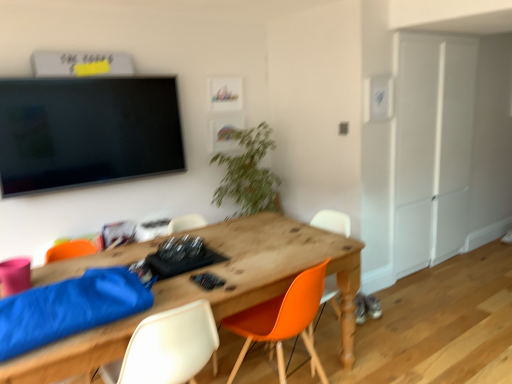
Question: Should I look upward or downward to see orange plastic chair at center, which is the second chair in right-to-left order?

Choices:
 (A) down
 (B) up

Answer: (A)

Question: From the image's perspective, does orange plastic chair at center, which is the second chair in right-to-left order, appear higher than wooden desk at center?

Choices:
 (A) no
 (B) yes

Answer: (B)

Question: Is orange plastic chair at center, which is the second chair in right-to-left order, further to camera compared to wooden desk at center?

Choices:
 (A) no
 (B) yes

Answer: (B)

Question: Is orange plastic chair at center, which is the second chair in right-to-left order, to the right of wooden desk at center from the viewer's perspective?

Choices:
 (A) no
 (B) yes

Answer: (B)

Question: Is orange plastic chair at center, which is the second chair from left to right, not within wooden desk at center?

Choices:
 (A) no
 (B) yes

Answer: (A)

Question: From the image's perspective, is orange plastic chair at center, which is the second chair from left to right, under wooden desk at center?

Choices:
 (A) no
 (B) yes

Answer: (A)

Question: Is orange plastic chair at center, which is the second chair in right-to-left order, bigger than wooden desk at center?

Choices:
 (A) no
 (B) yes

Answer: (A)

Question: Considering the relative sizes of orange plastic chair at center, which is the second chair in right-to-left order, and orange matte chair at center, the third chair from the left, in the image provided, is orange plastic chair at center, which is the second chair in right-to-left order, bigger than orange matte chair at center, the third chair from the left,?

Choices:
 (A) yes
 (B) no

Answer: (A)

Question: From the image's perspective, does orange plastic chair at center, which is the second chair from left to right, appear higher than orange matte chair at center, the third chair from the left?

Choices:
 (A) no
 (B) yes

Answer: (A)

Question: Considering the relative sizes of orange plastic chair at center, which is the second chair in right-to-left order, and orange matte chair at center, the third chair from the left, in the image provided, is orange plastic chair at center, which is the second chair in right-to-left order, wider than orange matte chair at center, the third chair from the left,?

Choices:
 (A) yes
 (B) no

Answer: (A)

Question: Is orange plastic chair at center, which is the second chair in right-to-left order, in front of orange matte chair at center, the third chair from the left?

Choices:
 (A) yes
 (B) no

Answer: (A)

Question: From a real-world perspective, is orange plastic chair at center, which is the second chair in right-to-left order, over orange matte chair at center, the third chair from the left?

Choices:
 (A) no
 (B) yes

Answer: (A)

Question: Is orange plastic chair at center, which is the second chair in right-to-left order, at the right side of orange matte chair at center, the third chair from the left?

Choices:
 (A) yes
 (B) no

Answer: (B)

Question: Does green leafy plant at center turn towards white plastic chair at lower center, which is the 1th chair from left to right?

Choices:
 (A) yes
 (B) no

Answer: (B)